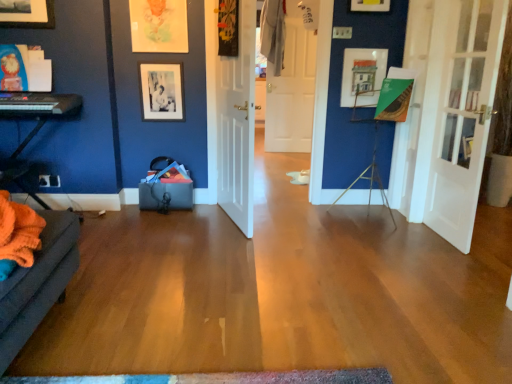
Question: Is black matte picture frame at upper center, which is counted as the third picture frame, starting from the right, located outside matte paper picture frame at upper center, which is counted as the second picture frame, starting from the left?

Choices:
 (A) no
 (B) yes

Answer: (B)

Question: From a real-world perspective, does black matte picture frame at upper center, marked as the first picture frame in a left-to-right arrangement, sit lower than matte paper picture frame at upper center, which appears as the 2th picture frame when viewed from the right?

Choices:
 (A) no
 (B) yes

Answer: (B)

Question: Would you say black matte picture frame at upper center, which is counted as the third picture frame, starting from the right, is a long distance from matte paper picture frame at upper center, which is counted as the second picture frame, starting from the left?

Choices:
 (A) no
 (B) yes

Answer: (A)

Question: Does black matte picture frame at upper center, which is counted as the third picture frame, starting from the right, appear on the right side of matte paper picture frame at upper center, which appears as the 2th picture frame when viewed from the right?

Choices:
 (A) yes
 (B) no

Answer: (B)

Question: Can you confirm if black matte picture frame at upper center, marked as the first picture frame in a left-to-right arrangement, is wider than matte paper picture frame at upper center, which is counted as the second picture frame, starting from the left?

Choices:
 (A) no
 (B) yes

Answer: (A)

Question: Looking at their shapes, would you say white matte door at center, the second door when ordered from right to left, is wider or thinner than orange fabric couch at left?

Choices:
 (A) thin
 (B) wide

Answer: (A)

Question: From a real-world perspective, is white matte door at center, which is the third door in front-to-back order, physically located above or below orange fabric couch at left?

Choices:
 (A) above
 (B) below

Answer: (A)

Question: Do you think white matte door at center, acting as the 2th door starting from the left, is within orange fabric couch at left, or outside of it?

Choices:
 (A) inside
 (B) outside

Answer: (B)

Question: Considering the positions of point (308, 54) and point (13, 172), is point (308, 54) closer or farther from the camera than point (13, 172)?

Choices:
 (A) closer
 (B) farther

Answer: (B)

Question: Is matte paper picture frame at upper center, which appears as the 2th picture frame when viewed from the right, inside or outside of orange fabric couch at left?

Choices:
 (A) outside
 (B) inside

Answer: (A)

Question: Visually, is matte paper picture frame at upper center, which is counted as the second picture frame, starting from the left, positioned to the left or to the right of orange fabric couch at left?

Choices:
 (A) left
 (B) right

Answer: (B)

Question: Considering their positions, is matte paper picture frame at upper center, which appears as the 2th picture frame when viewed from the right, located in front of or behind orange fabric couch at left?

Choices:
 (A) front
 (B) behind

Answer: (B)

Question: Considering the positions of point (183, 18) and point (78, 110), is point (183, 18) closer or farther from the camera than point (78, 110)?

Choices:
 (A) closer
 (B) farther

Answer: (B)

Question: Considering the positions of white glass door at right, the 1th door positioned from the front, and metallic tripod at center-right in the image, is white glass door at right, the 1th door positioned from the front, wider or thinner than metallic tripod at center-right?

Choices:
 (A) wide
 (B) thin

Answer: (B)

Question: Do you think white glass door at right, the 1th door positioned from the front, is within metallic tripod at center-right, or outside of it?

Choices:
 (A) outside
 (B) inside

Answer: (A)